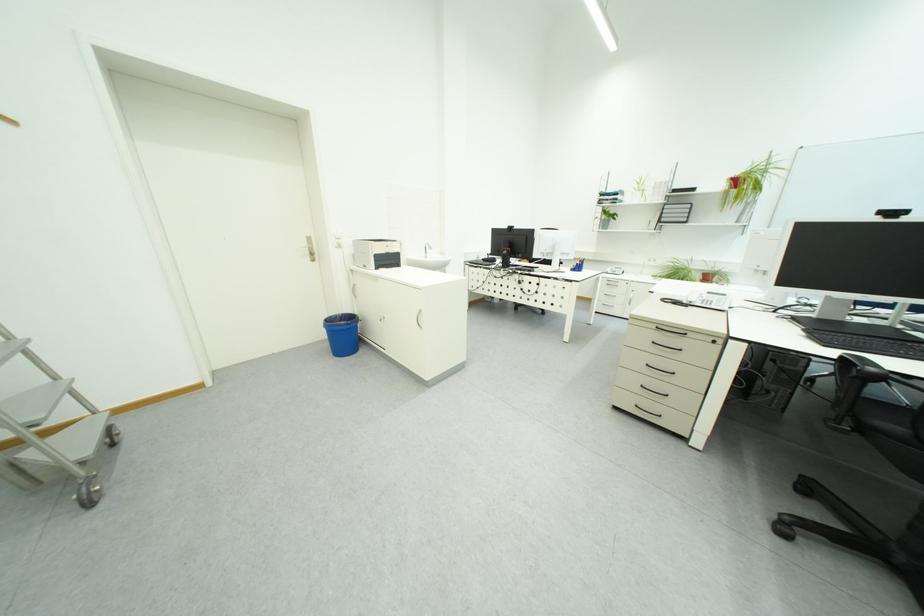
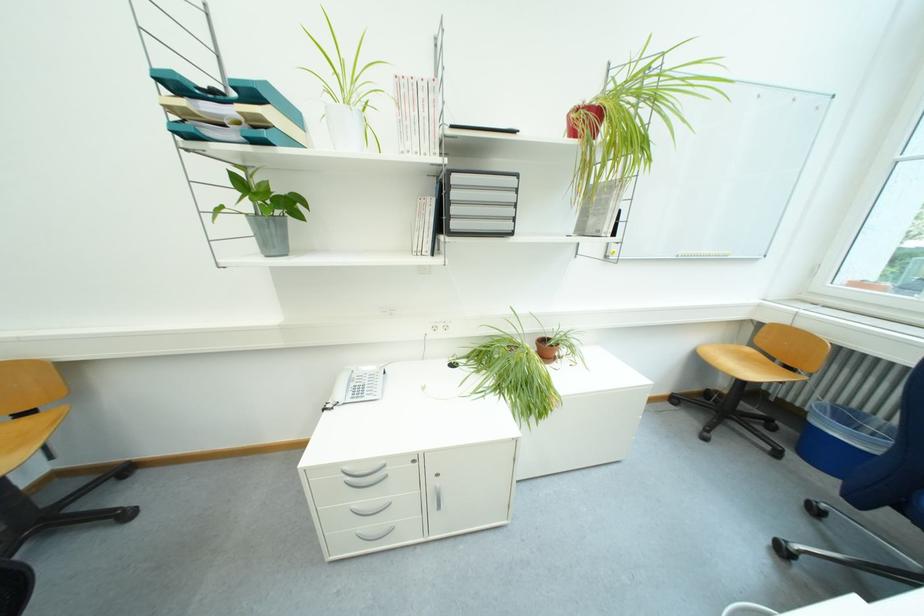
In the second image, find the point that corresponds to point (624, 217) in the first image.

(302, 206)